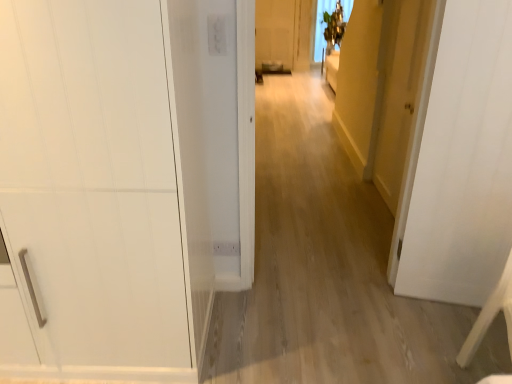
Locate an element on the screen. The image size is (512, 384). free space to the back side of yellow matte door at right, the first door when ordered from right to left is located at coordinates (353, 185).